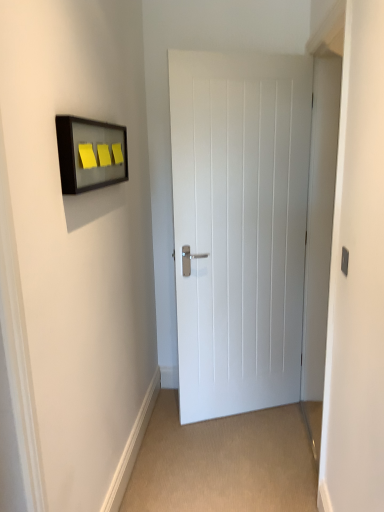
This screenshot has width=384, height=512. Describe the element at coordinates (90, 154) in the screenshot. I see `matte glass frame at upper left` at that location.

What do you see at coordinates (344, 260) in the screenshot?
I see `matte gray switch at right` at bounding box center [344, 260].

Find the location of `white painted wood door at center`. white painted wood door at center is located at coordinates (239, 227).

Does point (346, 275) come in front of point (61, 125)?

No, (346, 275) is behind (61, 125).

Is matte gray switch at right taller or shorter than matte glass frame at upper left?

Clearly, matte gray switch at right is shorter compared to matte glass frame at upper left.

Is matte gray switch at right at the right side of matte glass frame at upper left?

Yes, matte gray switch at right is to the right of matte glass frame at upper left.

From the image's perspective, would you say matte gray switch at right is shown under matte glass frame at upper left?

Yes.

The width and height of the screenshot is (384, 512). In order to click on medicine cabinet lying above the matte gray switch at right (from the image's perspective) in this screenshot , I will do `click(90, 154)`.

From the image's perspective, which is above, matte glass frame at upper left or matte gray switch at right?

matte glass frame at upper left is shown above in the image.

Considering the positions of objects matte glass frame at upper left and matte gray switch at right in the image provided, who is more to the right, matte glass frame at upper left or matte gray switch at right?

Positioned to the right is matte gray switch at right.

Is matte glass frame at upper left wider or thinner than matte gray switch at right?

Considering their sizes, matte glass frame at upper left looks broader than matte gray switch at right.

Where is `light switch in front of the white painted wood door at center`? light switch in front of the white painted wood door at center is located at coordinates (344, 260).

From a real-world perspective, who is located lower, matte gray switch at right or white painted wood door at center?

white painted wood door at center.

Is matte gray switch at right facing away from white painted wood door at center?

No, matte gray switch at right is not facing the opposite direction of white painted wood door at center.

In the scene shown: Is matte gray switch at right situated inside white painted wood door at center or outside?

matte gray switch at right is located beyond the bounds of white painted wood door at center.

Is point (82, 126) farther from viewer compared to point (257, 345)?

That is False.

In the scene shown: Is the position of matte glass frame at upper left less distant than that of white painted wood door at center?

Yes.

Where is `door below the matte glass frame at upper left (from the image's perspective)`? door below the matte glass frame at upper left (from the image's perspective) is located at coordinates (239, 227).

Is matte glass frame at upper left positioned with its back to white painted wood door at center?

matte glass frame at upper left is not turned away from white painted wood door at center.

Considering the sizes of objects white painted wood door at center and matte gray switch at right in the image provided, who is thinner, white painted wood door at center or matte gray switch at right?

matte gray switch at right is thinner.

Between point (266, 270) and point (347, 274), which one is positioned in front?

The point (347, 274) is closer.

Is white painted wood door at center aimed at matte gray switch at right?

Yes, white painted wood door at center is oriented towards matte gray switch at right.

Can you tell me how much white painted wood door at center and matte gray switch at right differ in facing direction?

There is a 116-degree angle between the facing directions of white painted wood door at center and matte gray switch at right.

Which is further, (251, 191) or (81, 156)?

The point (251, 191) is farther.

Is matte glass frame at upper left completely or partially inside white painted wood door at center?

No, matte glass frame at upper left is located outside of white painted wood door at center.

In the scene shown: Between white painted wood door at center and matte glass frame at upper left, which one has smaller size?

Smaller between the two is matte glass frame at upper left.

Does white painted wood door at center have a lesser height compared to matte glass frame at upper left?

No.

I want to click on light switch behind the matte glass frame at upper left, so click(x=344, y=260).

Identify the location of medicine cabinet in front of the matte gray switch at right. (90, 154).

Consider the image. Based on their spatial positions, is white painted wood door at center or matte glass frame at upper left closer to matte gray switch at right?

The object closer to matte gray switch at right is matte glass frame at upper left.

When comparing their distances from matte glass frame at upper left, does matte gray switch at right or white painted wood door at center seem further?

matte gray switch at right is further to matte glass frame at upper left.

Estimate the real-world distances between objects in this image. Which object is closer to white painted wood door at center, matte gray switch at right or matte glass frame at upper left?

The object closer to white painted wood door at center is matte glass frame at upper left.

Looking at the image, which one is located further to matte gray switch at right, matte glass frame at upper left or white painted wood door at center?

white painted wood door at center is positioned further to the anchor matte gray switch at right.

Which object lies nearer to the anchor point white painted wood door at center, matte glass frame at upper left or matte gray switch at right?

matte glass frame at upper left is positioned closer to the anchor white painted wood door at center.

Based on their spatial positions, is white painted wood door at center or matte gray switch at right closer to matte glass frame at upper left?

white painted wood door at center.

Image resolution: width=384 pixels, height=512 pixels. In order to click on door between matte glass frame at upper left and matte gray switch at right in this screenshot , I will do (239, 227).